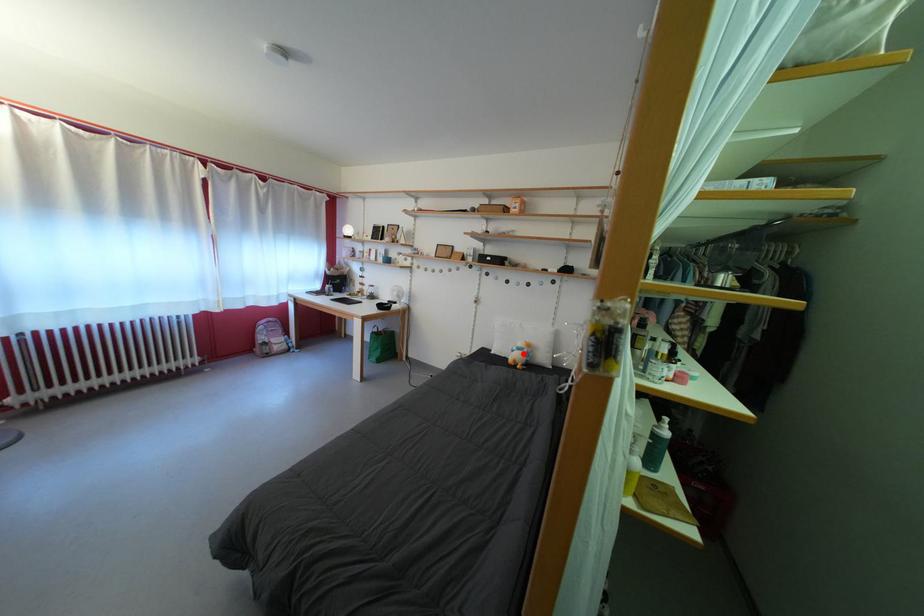
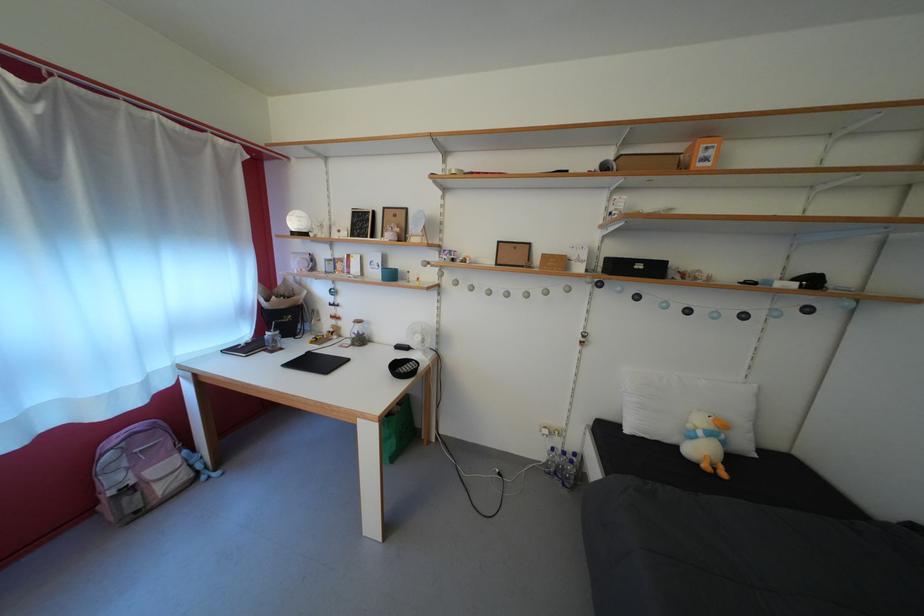
In the second image, find the point that corresponds to the highlighted location in the first image.

(709, 439)